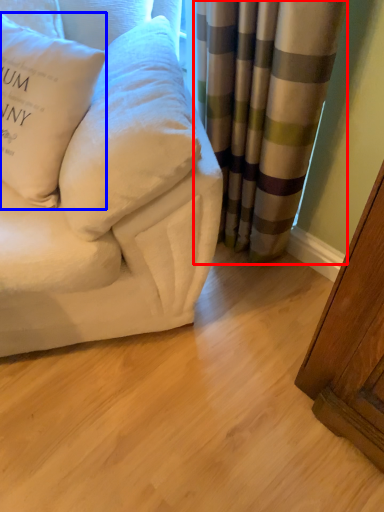
Question: Which point is further to the camera, curtain (highlighted by a red box) or pillow (highlighted by a blue box)?

Choices:
 (A) curtain
 (B) pillow

Answer: (A)